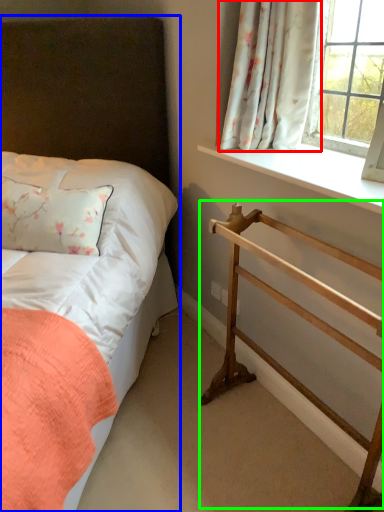
Question: Based on their relative distances, which object is farther from curtain (highlighted by a red box)? Choose from bed (highlighted by a blue box) and balustrade (highlighted by a green box).

Choices:
 (A) bed
 (B) balustrade

Answer: (A)